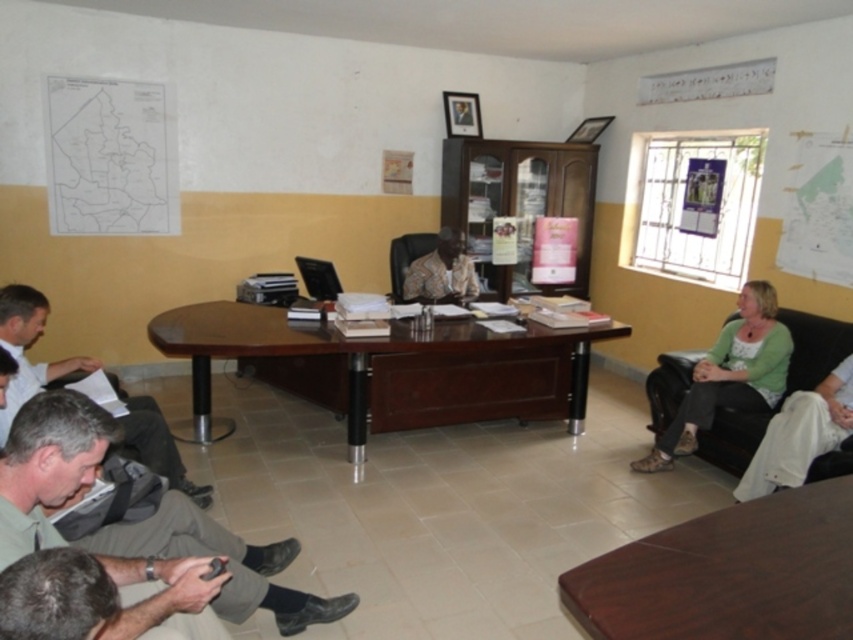
You are a tailor observing a person in the meeting room. You need to determine which of the two items, the gray fabric pants at lower left or the white fabric shirt at lower left, is narrower in width. Which one is it?

→ The gray fabric pants at lower left is thinner than the white fabric shirt at lower left, so the gray fabric pants at lower left is narrower in width.

Consider the image. You are organizing a meeting in this room and need to place a large presentation board. Which object, the brown wooden table at lower right or the patterned fabric shirt at center, is more suitable for placing the board due to size considerations?

The brown wooden table at lower right is bigger than the patterned fabric shirt at center, so it is more suitable for placing the large presentation board due to its larger size.

You are a delivery person who needs to place a small package between the gray fabric pants at lower left and the white fabric shirt at lower left. Can you fit the package there if it measures 1 meter in length?

The distance between the gray fabric pants at lower left and the white fabric shirt at lower left is 1.31 meters, so yes, the package can fit as it is shorter than the available space.